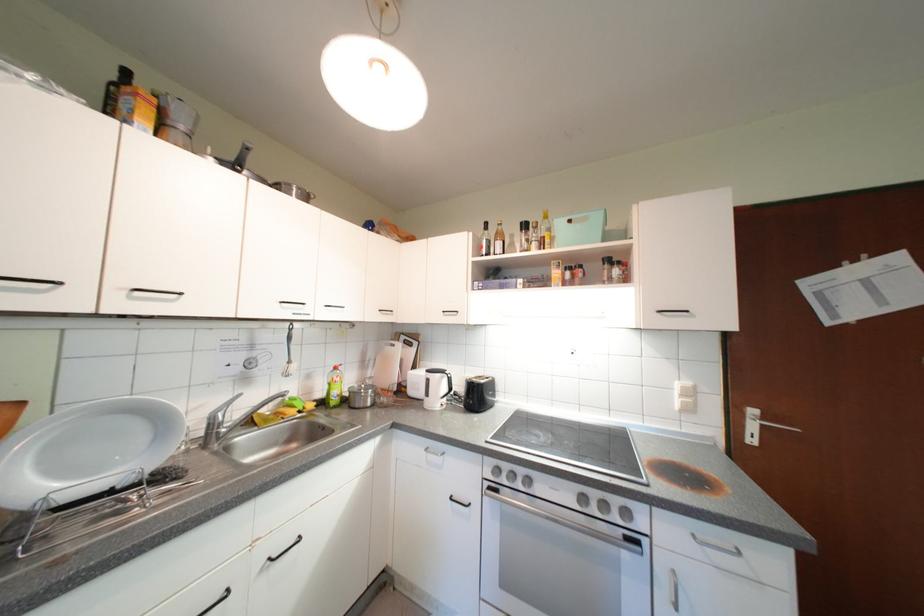
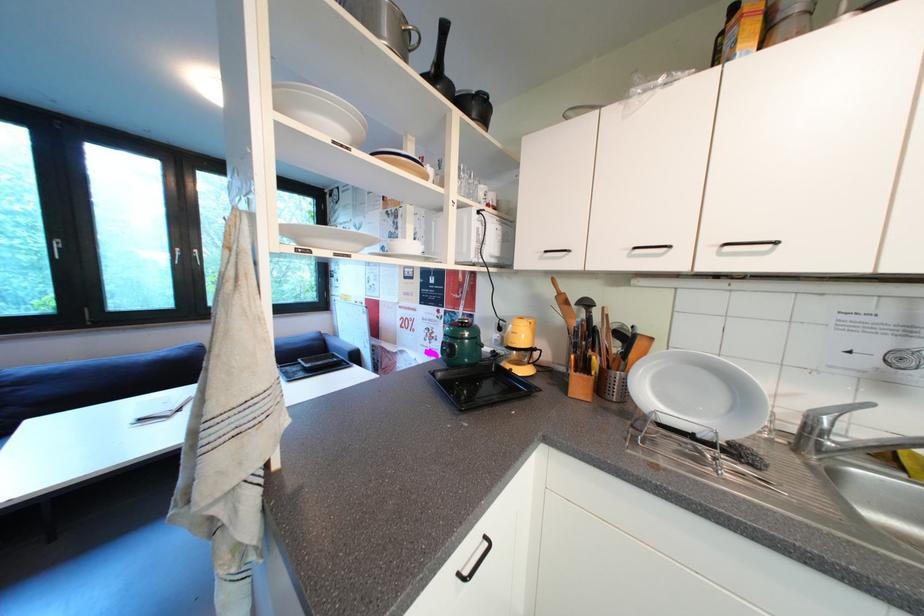
Question: The first image is from the beginning of the video and the second image is from the end. How did the camera likely rotate when shooting the video?

Choices:
 (A) Left
 (B) Right
 (C) Up
 (D) Down

Answer: (A)